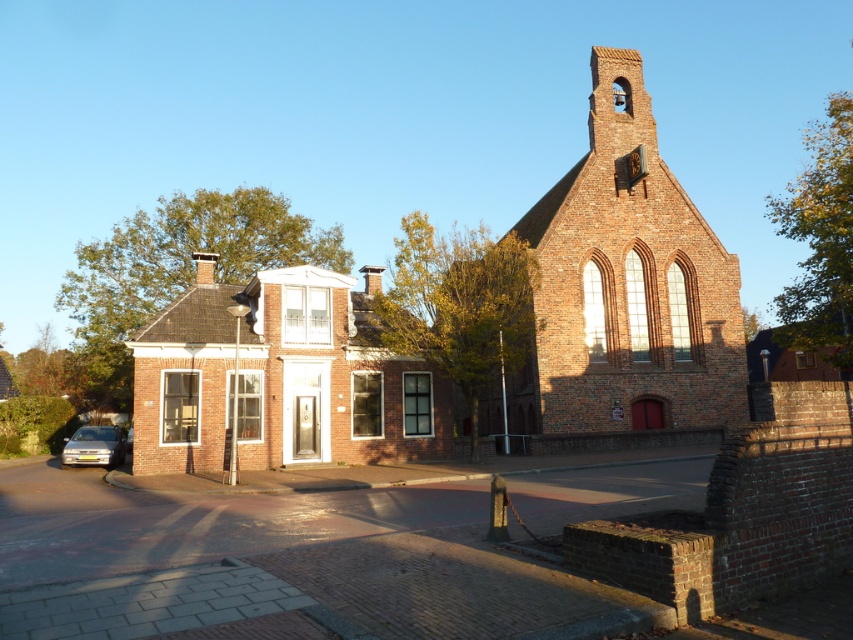
Can you confirm if brick church at center is positioned to the left of silver metallic car at lower left?

No, brick church at center is not to the left of silver metallic car at lower left.

Who is more distant from viewer, (552, 305) or (103, 442)?

Positioned behind is point (552, 305).

This screenshot has height=640, width=853. Identify the location of brick church at center. click(625, 285).

Identify the location of brick church at center. Image resolution: width=853 pixels, height=640 pixels. (625, 285).

From the picture: Does brick church at center have a greater width compared to brick house at center?

No.

Between brick church at center and brick house at center, which one has more height?

brick church at center is taller.

Describe the element at coordinates (625, 285) in the screenshot. I see `brick church at center` at that location.

The image size is (853, 640). What are the coordinates of `brick church at center` in the screenshot? It's located at (625, 285).

Which is more to the left, brick house at center or silver metallic car at lower left?

silver metallic car at lower left

Which of these two, brick house at center or silver metallic car at lower left, stands taller?

With more height is brick house at center.

Which is behind, point (248, 298) or point (74, 445)?

Positioned behind is point (248, 298).

At what (x,y) coordinates should I click in order to perform the action: click on brick house at center. Please return your answer as a coordinate pair (x, y). Looking at the image, I should click on (277, 378).